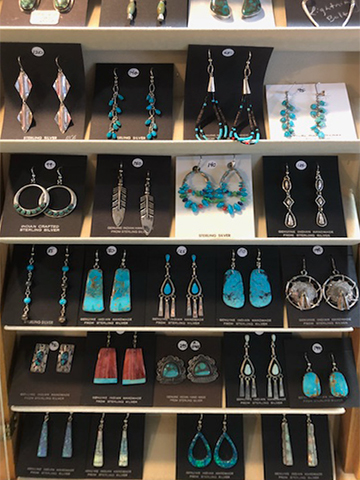
Where is `white plastic shelf`? This screenshot has height=480, width=360. white plastic shelf is located at coordinates (304, 38), (182, 148).